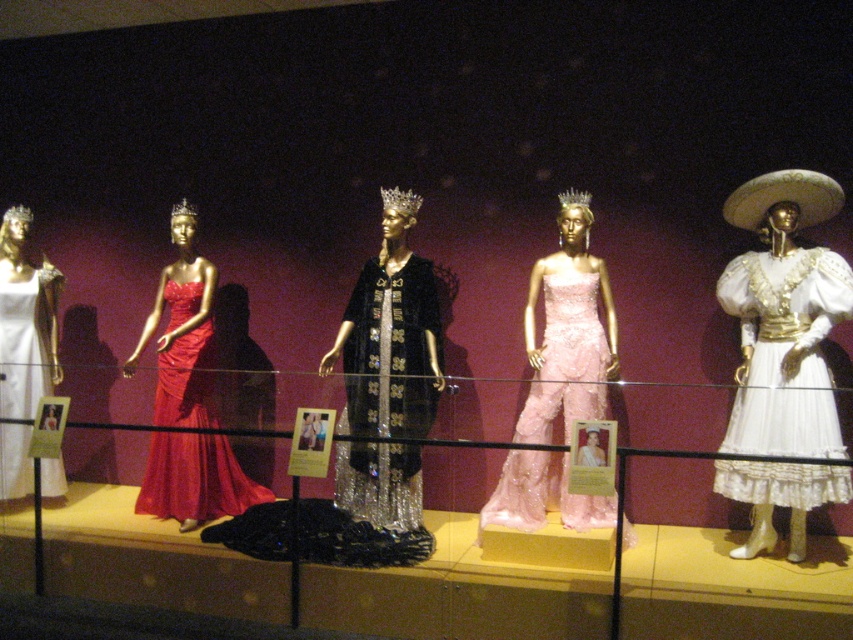
Who is shorter, white lace dress at right or shiny black fabric dress at center?

shiny black fabric dress at center

Does white lace dress at right have a greater width compared to shiny black fabric dress at center?

No, white lace dress at right is not wider than shiny black fabric dress at center.

What do you see at coordinates (784, 317) in the screenshot? I see `white lace dress at right` at bounding box center [784, 317].

Where is `white lace dress at right`? This screenshot has height=640, width=853. white lace dress at right is located at coordinates (784, 317).

Does pink satin jumpsuit at center appear on the left side of shiny satin gown at center?

In fact, pink satin jumpsuit at center is to the right of shiny satin gown at center.

This screenshot has width=853, height=640. Find the location of `pink satin jumpsuit at center`. pink satin jumpsuit at center is located at coordinates (567, 330).

Is point (415, 269) behind point (181, 481)?

No.

Is the position of shiny black fabric dress at center more distant than that of shiny satin gown at center?

No, it is in front of shiny satin gown at center.

Find the location of a particular element. Image resolution: width=853 pixels, height=640 pixels. shiny black fabric dress at center is located at coordinates (390, 333).

Find the location of a particular element. This screenshot has width=853, height=640. shiny black fabric dress at center is located at coordinates (390, 333).